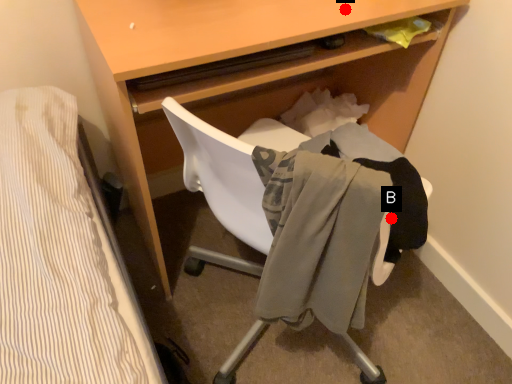
Question: Two points are circled on the image, labeled by A and B beside each circle. Which of the following is the closest to the observer?

Choices:
 (A) A is closer
 (B) B is closer

Answer: (B)